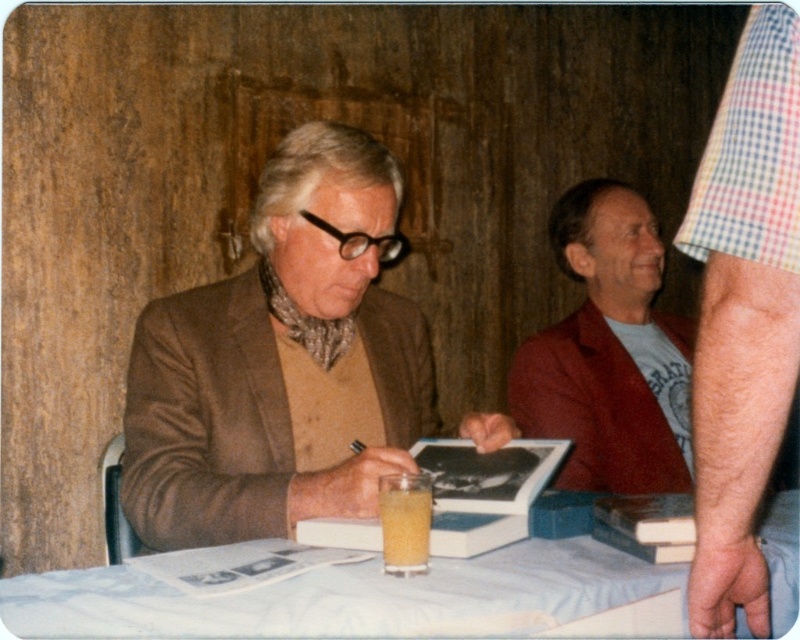
Question: Can you confirm if brown woolen jacket at left is wider than checkered fabric arm at right?

Choices:
 (A) yes
 (B) no

Answer: (A)

Question: Among these points, which one is farthest from the camera?

Choices:
 (A) (705, 486)
 (B) (516, 593)
 (C) (676, 381)

Answer: (C)

Question: Does brown woolen jacket at left have a smaller size compared to white cloth at lower center?

Choices:
 (A) yes
 (B) no

Answer: (B)

Question: Can you confirm if red velvet blazer at right is smaller than translucent yellow liquid at table center?

Choices:
 (A) no
 (B) yes

Answer: (A)

Question: Which point is closer to the camera?

Choices:
 (A) brown woolen jacket at left
 (B) white cloth at lower center
 (C) translucent yellow liquid at table center
 (D) checkered fabric arm at right

Answer: (D)

Question: Among these objects, which one is nearest to the camera?

Choices:
 (A) checkered fabric arm at right
 (B) translucent yellow liquid at table center
 (C) brown woolen jacket at left
 (D) red velvet blazer at right

Answer: (A)